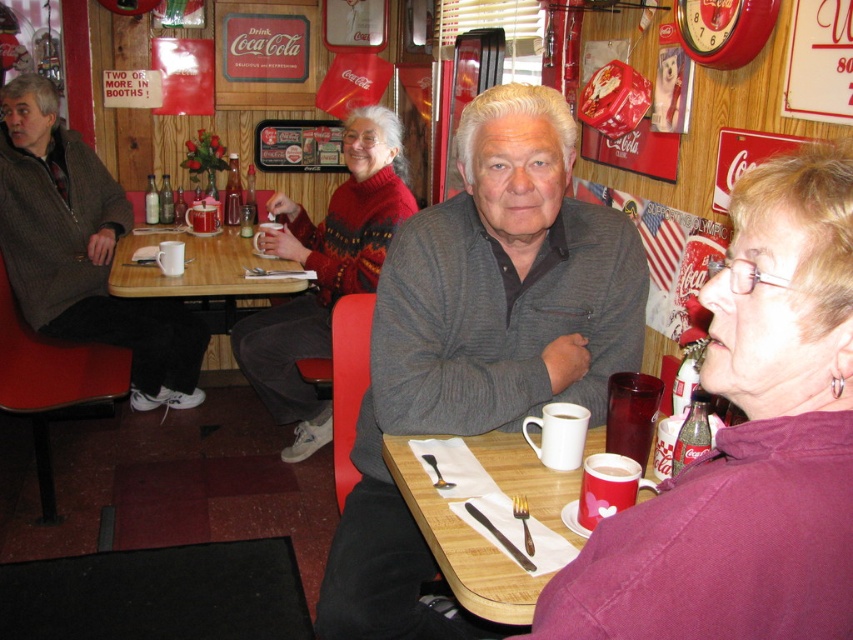
Describe the element at coordinates (82, 250) in the screenshot. I see `knit sweater at left` at that location.

Can you confirm if knit sweater at left is smaller than wooden table at center?

Incorrect, knit sweater at left is not smaller in size than wooden table at center.

Between point (144, 304) and point (202, 236), which one is positioned in front?

Positioned in front is point (144, 304).

Locate an element on the screen. knit sweater at left is located at coordinates (82, 250).

Can you confirm if gray knit sweater at center is positioned to the left of white matte mug at lower center?

Yes, gray knit sweater at center is to the left of white matte mug at lower center.

This screenshot has height=640, width=853. Describe the element at coordinates (479, 339) in the screenshot. I see `gray knit sweater at center` at that location.

Which is behind, point (431, 324) or point (627, 474)?

Positioned behind is point (431, 324).

You are a GUI agent. You are given a task and a screenshot of the screen. Output one action in this format:
    pyautogui.click(x=<x>, y=<y>)
    Task: Click on the gray knit sweater at center
    
    Given the screenshot: What is the action you would take?
    pyautogui.click(x=479, y=339)

Which is below, knit sweater at left or white matte mug at upper center?

white matte mug at upper center is lower down.

Does knit sweater at left have a greater height compared to white matte mug at upper center?

Indeed, knit sweater at left has a greater height compared to white matte mug at upper center.

Which is in front, point (105, 317) or point (563, 406)?

Point (563, 406)

At what (x,y) coordinates should I click in order to perform the action: click on knit sweater at left. Please return your answer as a coordinate pair (x, y). This screenshot has height=640, width=853. Looking at the image, I should click on (82, 250).